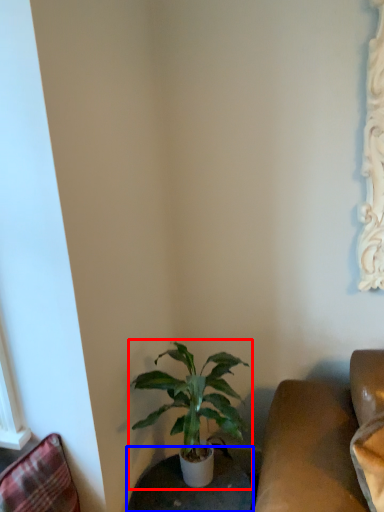
Question: Among these objects, which one is farthest to the camera, houseplant (highlighted by a red box) or round table (highlighted by a blue box)?

Choices:
 (A) houseplant
 (B) round table

Answer: (B)